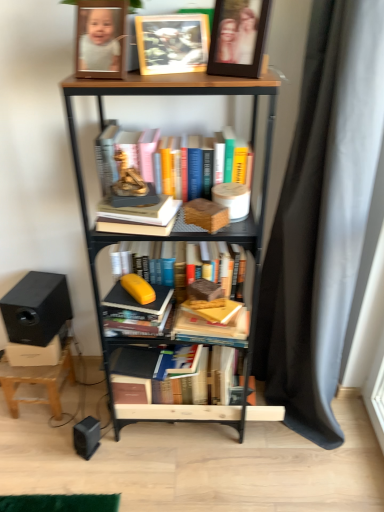
Locate an element on the screen. The image size is (384, 512). vacant point to the left of wooden picture frame at upper center, arranged as the 2th picture frame when viewed from the left is located at coordinates (179, 76).